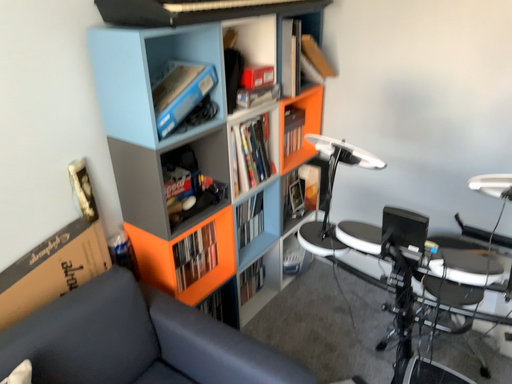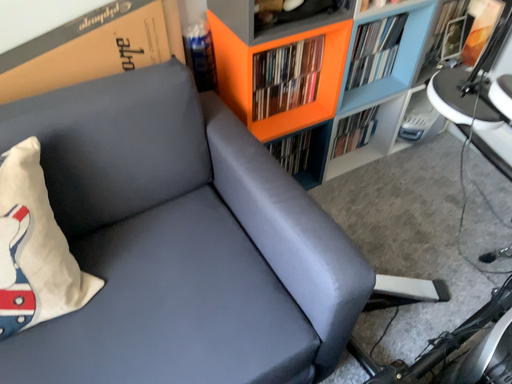
Question: Which way did the camera rotate in the video?

Choices:
 (A) rotated downward
 (B) rotated upward

Answer: (A)